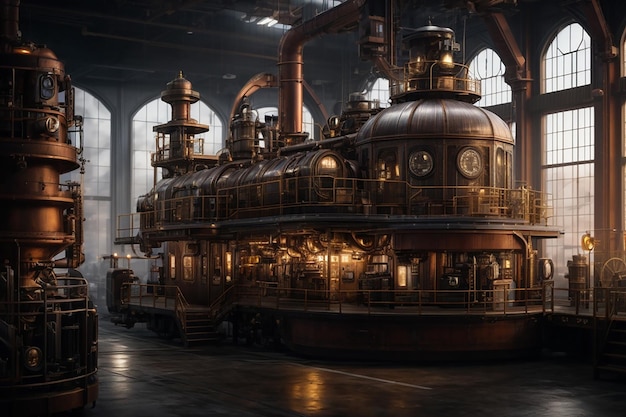
This screenshot has height=417, width=626. I want to click on round windows, so click(422, 165), click(473, 163).